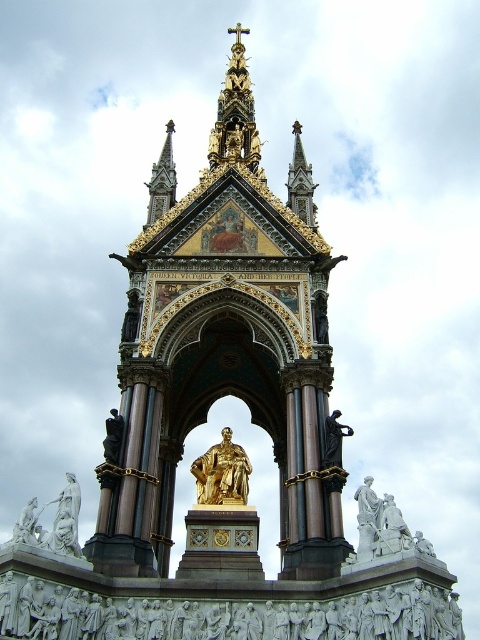
Question: Which point appears farthest from the camera in this image?

Choices:
 (A) (40, 509)
 (B) (199, 497)

Answer: (A)

Question: Can you confirm if gold polished statue at center is thinner than white marble statue at lower left?

Choices:
 (A) no
 (B) yes

Answer: (B)

Question: Is polished bronze statue at center-right below white marble statue at lower left?

Choices:
 (A) yes
 (B) no

Answer: (B)

Question: Considering the real-world distances, which object is farthest from the polished bronze statue at center-right?

Choices:
 (A) white marble statue at lower left
 (B) gold polished statue at center

Answer: (A)

Question: Observing the image, what is the correct spatial positioning of gold polished statue at center in reference to white marble statue at lower left?

Choices:
 (A) left
 (B) right

Answer: (B)

Question: Which of the following is the closest to the observer?

Choices:
 (A) white marble statue at lower left
 (B) gold polished statue at center

Answer: (A)